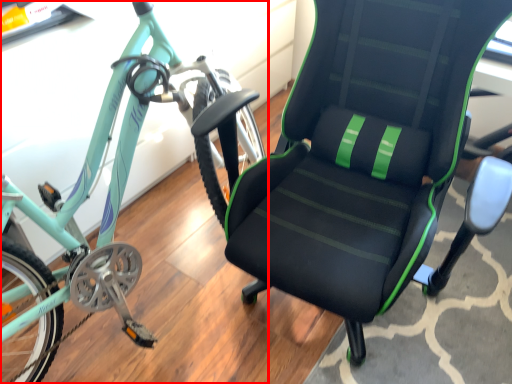
Question: From the image, what is the correct spatial relationship of bicycle (annotated by the red box) in relation to chair?

Choices:
 (A) left
 (B) right

Answer: (A)